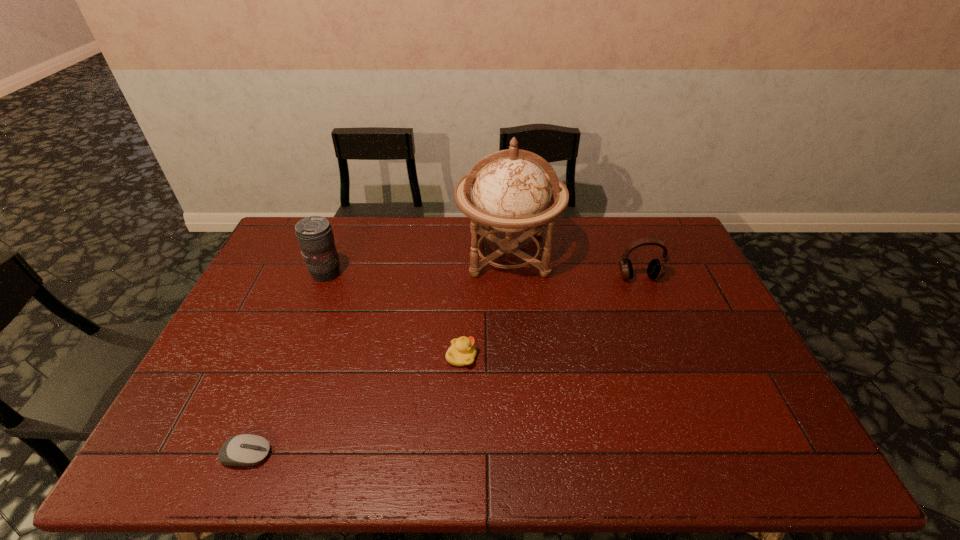
Image resolution: width=960 pixels, height=540 pixels. Find the location of `the tallest object`. the tallest object is located at coordinates (511, 193).

Locate an element on the screen. The width and height of the screenshot is (960, 540). the second tallest object is located at coordinates (314, 234).

Identify the location of the rightmost object. tap(656, 269).

Locate an element on the screen. The width and height of the screenshot is (960, 540). headset is located at coordinates (656, 269).

You are a GUI agent. You are given a task and a screenshot of the screen. Output one action in this format:
    pyautogui.click(x=<x>, y=<y>)
    Task: Click on the fourth tallest object
    The height and width of the screenshot is (540, 960).
    Given the screenshot: What is the action you would take?
    pyautogui.click(x=462, y=352)

This screenshot has width=960, height=540. What are the coordinates of `duckling` in the screenshot? It's located at 462,352.

I want to click on the shortest object, so click(245, 449).

Find the location of `computer equipment`. computer equipment is located at coordinates (245, 449).

The image size is (960, 540). I want to click on vacant region located 0.260m at the front of the globe showing Africa, so click(x=516, y=354).

At what (x,y) coordinates should I click in order to perform the action: click on vacant space located 0.290m on the side of the telephoto lens where the control switches are located. Please return your answer as a coordinate pair (x, y). Image resolution: width=960 pixels, height=540 pixels. Looking at the image, I should click on (429, 273).